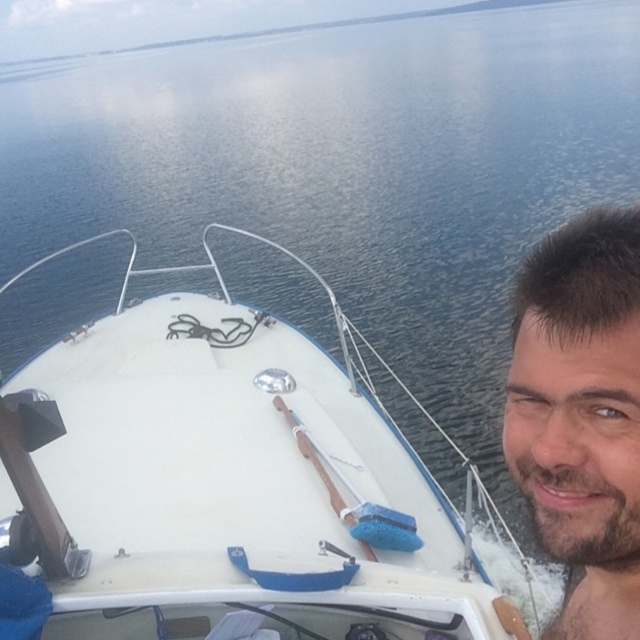
You are planning to take a photo of the white matte boat at center and the bearded man at right. Considering their sizes, which object should you zoom in more on to ensure both are clearly visible in the frame?

Since the white matte boat at center is larger than the bearded man at right, you should zoom in more on the bearded man at right to ensure both are clearly visible in the frame.